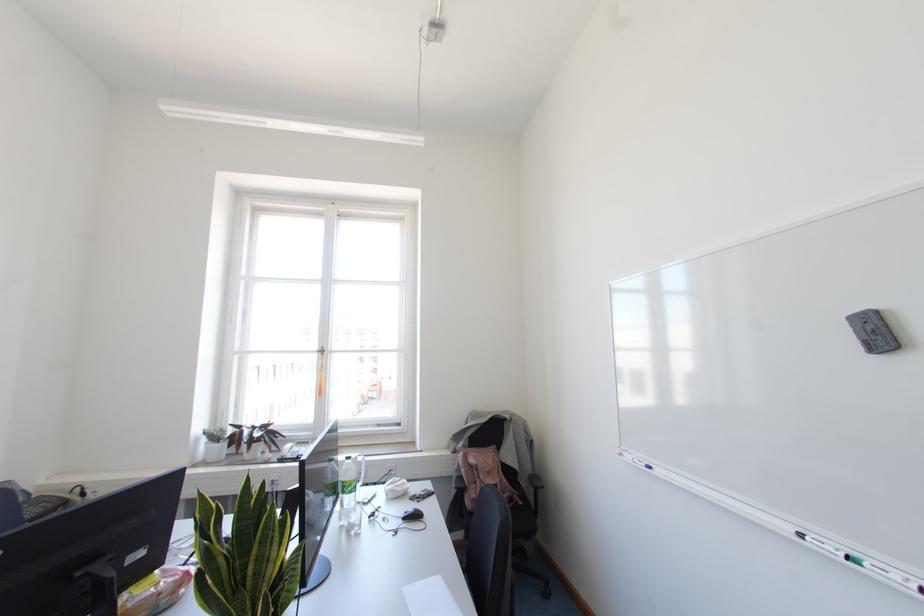
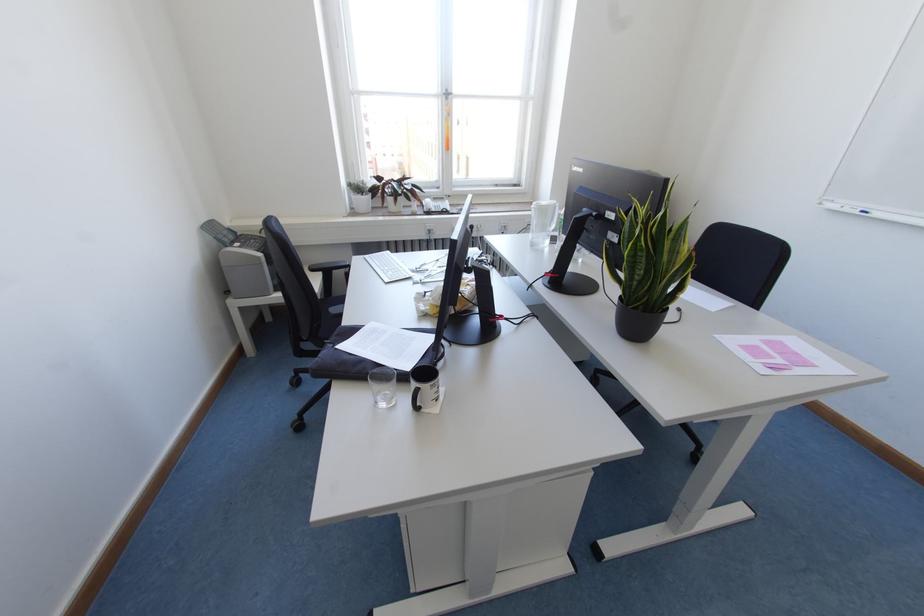
In the second image, find the point that corresponds to (216,442) in the first image.

(361, 195)